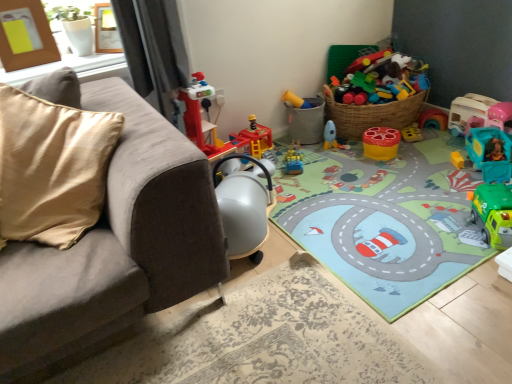
Where is `vacant space positioned to the left of teal plastic toy car at right, marked as the first toy in a right-to-left arrangement`? Image resolution: width=512 pixels, height=384 pixels. vacant space positioned to the left of teal plastic toy car at right, marked as the first toy in a right-to-left arrangement is located at coordinates (435, 142).